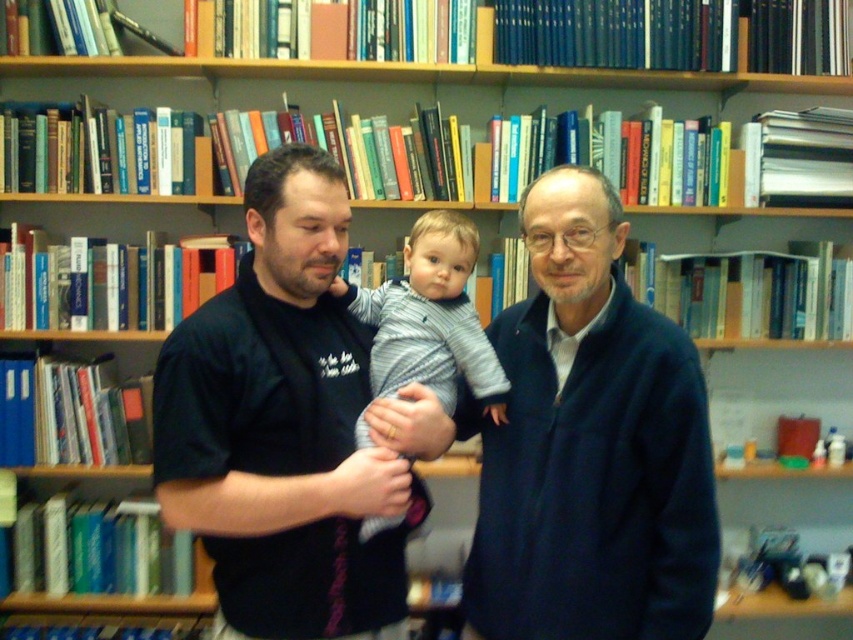
Question: Among these objects, which one is nearest to the camera?

Choices:
 (A) striped knit sweater at center
 (B) black t-shirt at center
 (C) navy blue sweater at center

Answer: (B)

Question: Which point appears closest to the camera in this image?

Choices:
 (A) (456, 221)
 (B) (416, 480)
 (C) (555, 545)

Answer: (C)

Question: Is black t-shirt at center thinner than striped knit sweater at center?

Choices:
 (A) yes
 (B) no

Answer: (B)

Question: Which object appears farthest from the camera in this image?

Choices:
 (A) striped knit sweater at center
 (B) black t-shirt at center

Answer: (A)

Question: Can you confirm if navy blue sweater at center is bigger than striped knit sweater at center?

Choices:
 (A) no
 (B) yes

Answer: (B)

Question: Is navy blue sweater at center wider than striped knit sweater at center?

Choices:
 (A) yes
 (B) no

Answer: (A)